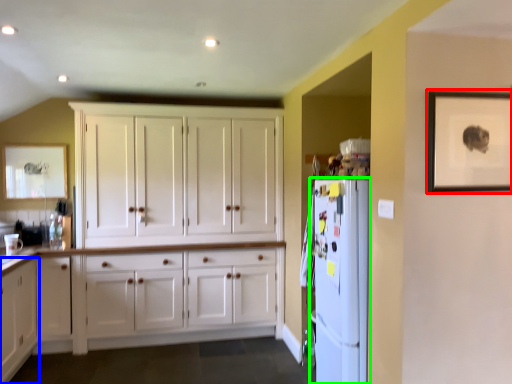
Question: Based on their relative distances, which object is nearer to picture frame (highlighted by a red box)? Choose from cabinetry (highlighted by a blue box) and refrigerator (highlighted by a green box).

Choices:
 (A) cabinetry
 (B) refrigerator

Answer: (B)